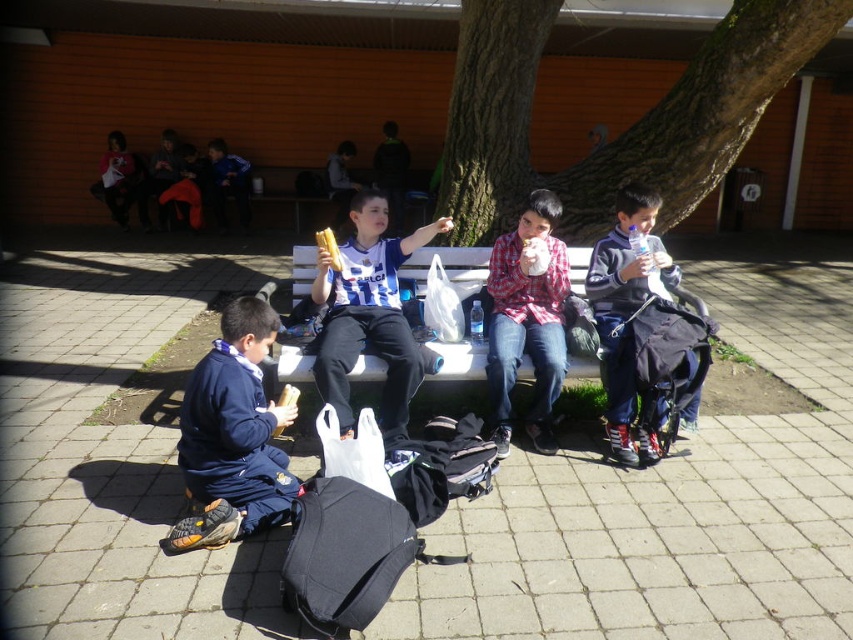
Can you confirm if navy blue uniform at lower left is thinner than plaid cotton shirt at center?

No, navy blue uniform at lower left is not thinner than plaid cotton shirt at center.

This screenshot has height=640, width=853. Describe the element at coordinates (231, 436) in the screenshot. I see `navy blue uniform at lower left` at that location.

Image resolution: width=853 pixels, height=640 pixels. I want to click on navy blue uniform at lower left, so click(231, 436).

Is matte blue and white jersey at center positioned before matte gray jacket at right?

Yes, it is.

Between matte blue and white jersey at center and matte gray jacket at right, which one appears on the right side from the viewer's perspective?

Positioned to the right is matte gray jacket at right.

Between point (381, 204) and point (643, 196), which one is positioned in front?

Positioned in front is point (643, 196).

You are a GUI agent. You are given a task and a screenshot of the screen. Output one action in this format:
    pyautogui.click(x=<x>, y=<y>)
    Task: Click on the matte blue and white jersey at center
    The height and width of the screenshot is (640, 853).
    Given the screenshot: What is the action you would take?
    pyautogui.click(x=368, y=314)

Who is positioned more to the right, plaid cotton shirt at center or white plastic bench at center?

From the viewer's perspective, plaid cotton shirt at center appears more on the right side.

Find the location of a particular element. plaid cotton shirt at center is located at coordinates (527, 317).